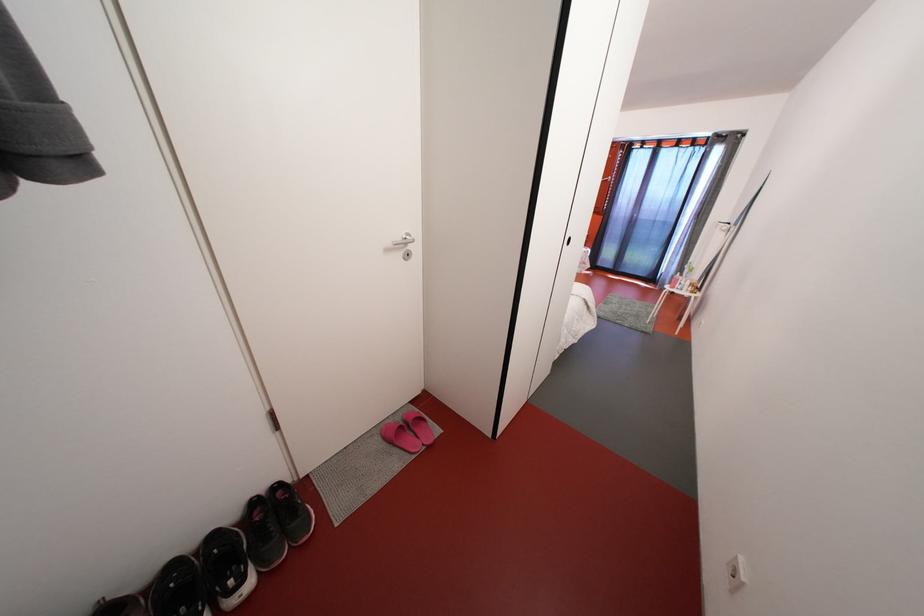
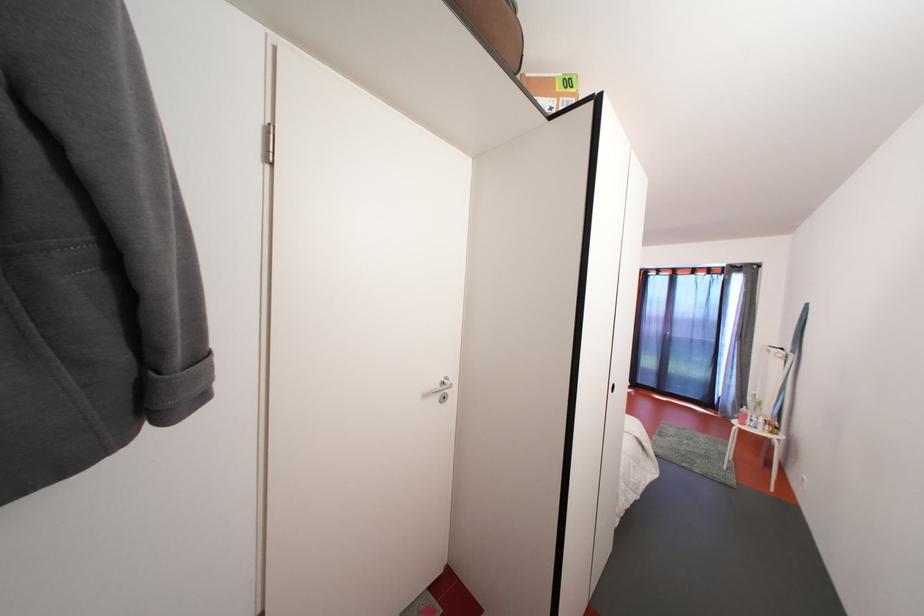
Find the pixel in the second image that matches pixel 406 245 in the first image.

(444, 391)